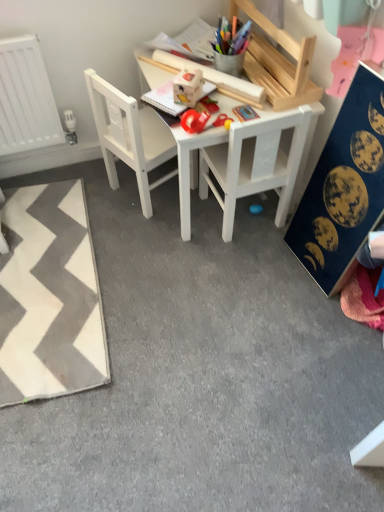
The height and width of the screenshot is (512, 384). I want to click on free space between white matte chair at center, the second chair from the right, and white zigzag rug at lower left, so click(140, 261).